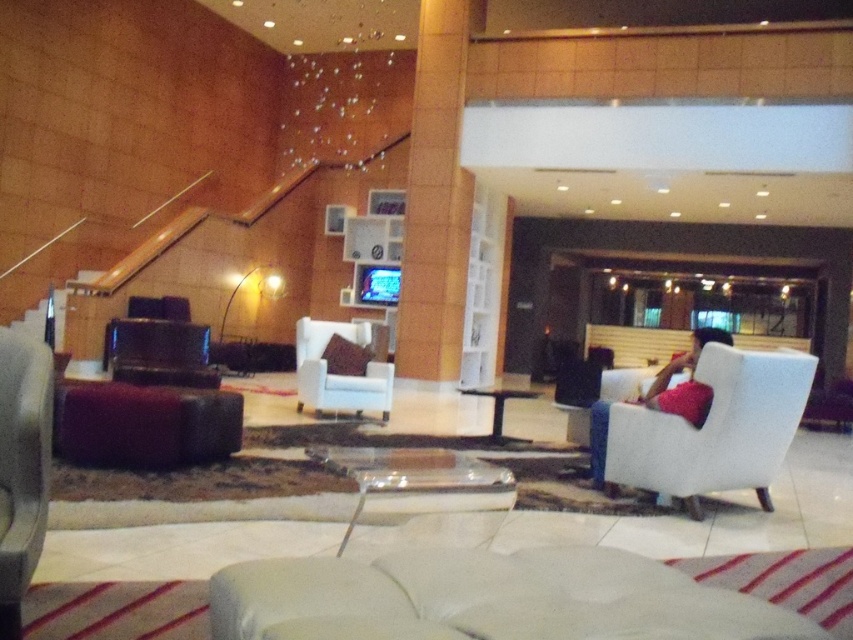
Question: Among these objects, which one is farthest from the camera?

Choices:
 (A) matte black armchair at left
 (B) wooden pillar at center
 (C) velvet dark brown ottoman at center

Answer: (B)

Question: Among these objects, which one is farthest from the camera?

Choices:
 (A) matte black armchair at left
 (B) matte black chair at left
 (C) white fabric armchair at center

Answer: (C)

Question: Does matte black armchair at left appear on the left side of white fabric armchair at center?

Choices:
 (A) no
 (B) yes

Answer: (B)

Question: Which object is closer to the camera taking this photo?

Choices:
 (A) white fabric chair at center
 (B) matte black armchair at left
 (C) velvet dark brown ottoman at center
 (D) wooden pillar at center

Answer: (B)

Question: Is velvet dark brown ottoman at center closer to camera compared to matte black chair at left?

Choices:
 (A) no
 (B) yes

Answer: (B)

Question: Does white fabric chair at center have a greater width compared to velvet dark brown ottoman at center?

Choices:
 (A) yes
 (B) no

Answer: (A)